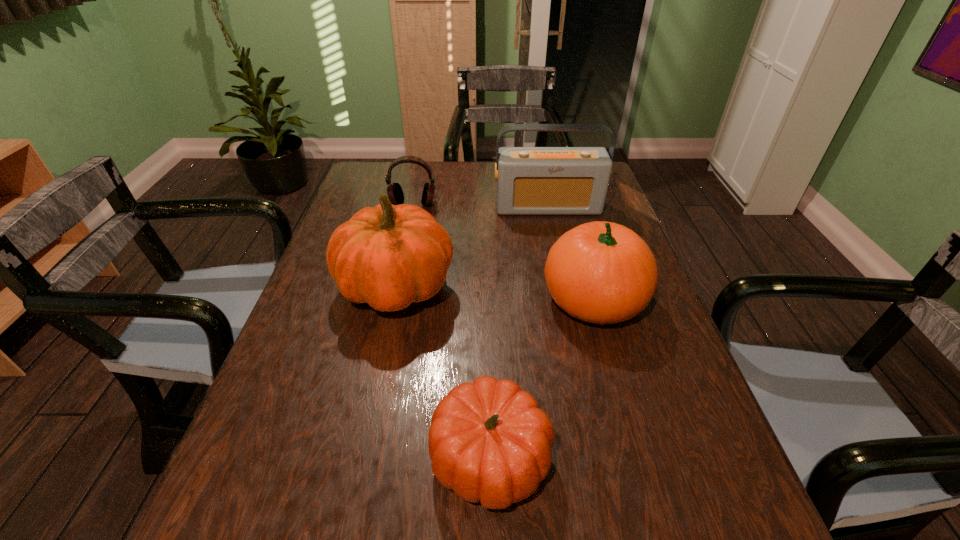
Locate an element on the screen. vacant space that's between the third tallest object and the nearest pumpkin is located at coordinates (542, 378).

Identify the location of free spot between the radio receiver and the nearest pumpkin. The width and height of the screenshot is (960, 540). (519, 332).

The height and width of the screenshot is (540, 960). What are the coordinates of `free space between the shortest pumpkin and the radio receiver` in the screenshot? It's located at [519, 332].

At what (x,y) coordinates should I click in order to perform the action: click on empty space between the nearest object and the third shortest object. Please return your answer as a coordinate pair (x, y). This screenshot has width=960, height=540. Looking at the image, I should click on (542, 378).

You are a GUI agent. You are given a task and a screenshot of the screen. Output one action in this format:
    pyautogui.click(x=<x>, y=<y>)
    Task: Click on the vacant area between the tallest pumpkin and the nearest object
    The image size is (960, 540).
    Given the screenshot: What is the action you would take?
    pyautogui.click(x=444, y=373)

Where is `vacant area between the tallest pumpkin and the radio receiver`? Image resolution: width=960 pixels, height=540 pixels. vacant area between the tallest pumpkin and the radio receiver is located at coordinates (472, 247).

Locate an element on the screen. This screenshot has height=540, width=960. free space between the radio receiver and the tallest pumpkin is located at coordinates pos(472,247).

The height and width of the screenshot is (540, 960). Find the location of `free space between the second shortest pumpkin and the tallest pumpkin`. free space between the second shortest pumpkin and the tallest pumpkin is located at coordinates (494, 293).

The height and width of the screenshot is (540, 960). Find the location of `vacant space in between the tallest pumpkin and the second tallest pumpkin`. vacant space in between the tallest pumpkin and the second tallest pumpkin is located at coordinates (494, 293).

Image resolution: width=960 pixels, height=540 pixels. What are the coordinates of `free space between the second tallest pumpkin and the nearest object` in the screenshot? It's located at (542, 378).